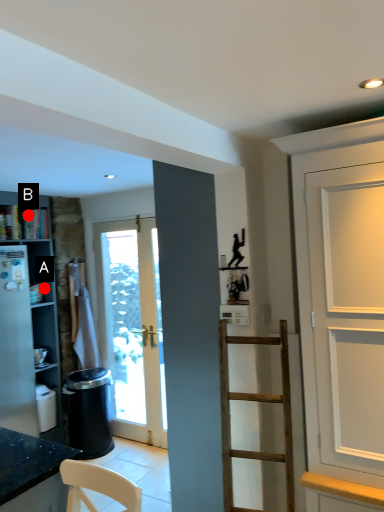
Question: Two points are circled on the image, labeled by A and B beside each circle. Which of the following is the closest to the observer?

Choices:
 (A) A is closer
 (B) B is closer

Answer: (B)